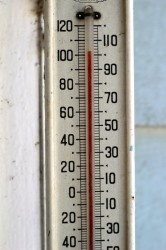
Image resolution: width=166 pixels, height=250 pixels. I want to click on bracket, so click(95, 16).